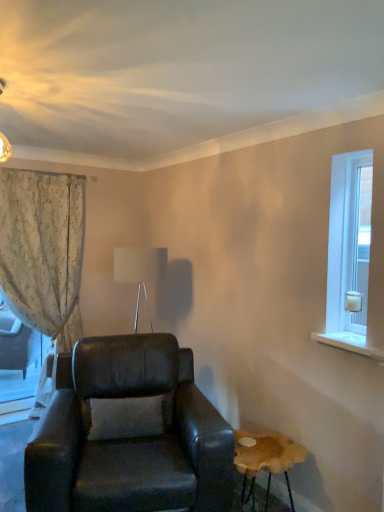
Question: Would you say clear glass door at right is to the left or to the right of wooden stool at lower right in the picture?

Choices:
 (A) left
 (B) right

Answer: (B)

Question: Choose the correct answer: Is clear glass door at right inside wooden stool at lower right or outside it?

Choices:
 (A) inside
 (B) outside

Answer: (B)

Question: Which object is positioned farthest from the leather armchair at center?

Choices:
 (A) floral fabric curtain at left
 (B) wooden stool at lower right
 (C) white fabric lampshade at upper center
 (D) clear glass door at right

Answer: (D)

Question: Which is farther from the wooden stool at lower right?

Choices:
 (A) white fabric lampshade at upper center
 (B) floral fabric curtain at left
 (C) leather armchair at center
 (D) clear glass door at right

Answer: (B)